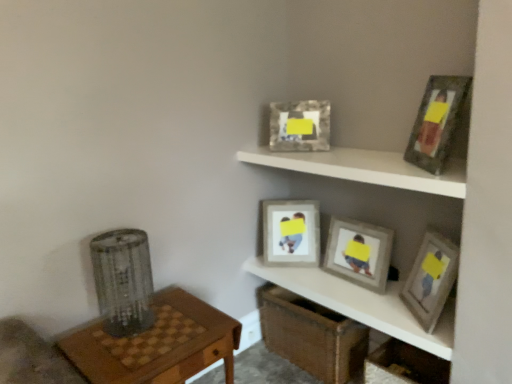
Where is `wooden picture frames at center, positioned as the 1th shelf in bottom-to-top order`? The width and height of the screenshot is (512, 384). wooden picture frames at center, positioned as the 1th shelf in bottom-to-top order is located at coordinates (362, 304).

Identify the location of woven brown crate at lower center. The width and height of the screenshot is (512, 384). (311, 335).

The image size is (512, 384). What do you see at coordinates (158, 344) in the screenshot?
I see `wooden at left` at bounding box center [158, 344].

Locate an element on the screen. The width and height of the screenshot is (512, 384). wooden picture frames at center, acting as the 2th shelf starting from the top is located at coordinates (362, 304).

Does point (446, 271) come behind point (292, 112)?

No, it is not.

Would you say matte gray picture frame at upper right, which appears as the fourth picture frame when viewed from the back, is a long distance from metallic silver picture frame at upper center, the fourth picture frame in the front-to-back sequence?

matte gray picture frame at upper right, which appears as the fourth picture frame when viewed from the back, is near metallic silver picture frame at upper center, the fourth picture frame in the front-to-back sequence, not far away.

Measure the distance between matte gray picture frame at upper right, which is the 2th picture frame in front-to-back order, and metallic silver picture frame at upper center, the fourth picture frame in the front-to-back sequence.

They are 30.30 inches apart.

Which is more to the left, matte gray picture frame at upper right, which appears as the fourth picture frame when viewed from the back, or metallic silver picture frame at upper center, the fourth picture frame in the front-to-back sequence?

metallic silver picture frame at upper center, the fourth picture frame in the front-to-back sequence.

Considering the positions of objects wooden picture frames at center, acting as the 2th shelf starting from the top, and woven brown crate at lower center in the image provided, who is more to the left, wooden picture frames at center, acting as the 2th shelf starting from the top, or woven brown crate at lower center?

From the viewer's perspective, woven brown crate at lower center appears more on the left side.

From a real-world perspective, is wooden picture frames at center, positioned as the 1th shelf in bottom-to-top order, positioned above or below woven brown crate at lower center?

From a real-world perspective, wooden picture frames at center, positioned as the 1th shelf in bottom-to-top order, is physically above woven brown crate at lower center.

Who is more distant, wooden picture frames at center, acting as the 2th shelf starting from the top, or woven brown crate at lower center?

woven brown crate at lower center is more distant.

Is point (362, 308) farther from viewer compared to point (294, 311)?

No, it is not.

Does white matte shelf at upper center, placed as the 1th shelf when sorted from top to bottom, contain wooden at left?

Definitely not — wooden at left is not inside white matte shelf at upper center, placed as the 1th shelf when sorted from top to bottom.

Which is farther from the camera, (316, 173) or (184, 320)?

Point (316, 173)

Which shelf is the 1st one when counting from the right side of the wooden at left? Please provide its 2D coordinates.

[(364, 168)]

From the image's perspective, which one is positioned lower, white matte shelf at upper center, placed as the 1th shelf when sorted from top to bottom, or wooden at left?

wooden at left.

Is wooden at left spatially inside matte gray picture frame at center, which appears as the 5th picture frame when viewed from the front, or outside of it?

wooden at left exists outside the volume of matte gray picture frame at center, which appears as the 5th picture frame when viewed from the front.

Considering the sizes of objects wooden at left and matte gray picture frame at center, which appears as the 5th picture frame when viewed from the front, in the image provided, who is thinner, wooden at left or matte gray picture frame at center, which appears as the 5th picture frame when viewed from the front,?

With smaller width is matte gray picture frame at center, which appears as the 5th picture frame when viewed from the front.

Is wooden at left to the right of matte gray picture frame at center, which appears as the 5th picture frame when viewed from the front, from the viewer's perspective?

In fact, wooden at left is to the left of matte gray picture frame at center, which appears as the 5th picture frame when viewed from the front.

From the image's perspective, does woven brown crate at lower center appear lower than wooden picture frame at upper right, the 5th picture frame in the back-to-front sequence?

Yes, from the image's perspective, woven brown crate at lower center is below wooden picture frame at upper right, the 5th picture frame in the back-to-front sequence.

Is the position of woven brown crate at lower center less distant than that of wooden picture frame at upper right, arranged as the 1th picture frame when viewed from the front?

That is False.

Does point (279, 324) come farther from viewer compared to point (463, 94)?

That is True.

Considering the relative positions of woven brown crate at lower center and wooden picture frame at upper right, arranged as the 1th picture frame when viewed from the front, in the image provided, is woven brown crate at lower center to the left or to the right of wooden picture frame at upper right, arranged as the 1th picture frame when viewed from the front,?

In the image, woven brown crate at lower center appears on the left side of wooden picture frame at upper right, arranged as the 1th picture frame when viewed from the front.

Choose the correct answer: Is matte gray picture frame at upper right, which is the 2th picture frame in front-to-back order, inside woven brown crate at lower center or outside it?

matte gray picture frame at upper right, which is the 2th picture frame in front-to-back order, is spatially situated outside woven brown crate at lower center.

Considering the sizes of objects matte gray picture frame at upper right, which is the 2th picture frame in front-to-back order, and woven brown crate at lower center in the image provided, who is bigger, matte gray picture frame at upper right, which is the 2th picture frame in front-to-back order, or woven brown crate at lower center?

Bigger between the two is woven brown crate at lower center.

Considering the points (444, 293) and (320, 338), which point is in front, point (444, 293) or point (320, 338)?

Point (444, 293)

Which is in front, matte gray picture frame at upper right, which appears as the fourth picture frame when viewed from the back, or woven brown crate at lower center?

matte gray picture frame at upper right, which appears as the fourth picture frame when viewed from the back.

From the image's perspective, is matte gray picture frame at center, the 3th picture frame when ordered from front to back, positioned above or below wooden at left?

matte gray picture frame at center, the 3th picture frame when ordered from front to back, is above wooden at left.

Considering the points (357, 265) and (181, 376), which point is behind, point (357, 265) or point (181, 376)?

Point (357, 265)

Considering the sizes of matte gray picture frame at center, the 3th picture frame when ordered from front to back, and wooden at left in the image, is matte gray picture frame at center, the 3th picture frame when ordered from front to back, taller or shorter than wooden at left?

In the image, matte gray picture frame at center, the 3th picture frame when ordered from front to back, appears to be shorter than wooden at left.

Does matte gray picture frame at center, which is the 3th picture frame in back-to-front order, have a greater width compared to wooden at left?

In fact, matte gray picture frame at center, which is the 3th picture frame in back-to-front order, might be narrower than wooden at left.

From a real-world perspective, count 2nd picture frames downward from the metallic silver picture frame at upper center, acting as the 2th picture frame starting from the back, and point to it. Please provide its 2D coordinates.

[(431, 279)]

From the image's perspective, starting from the woven brown crate at lower center, which shelf is the 1st one above? Please provide its 2D coordinates.

[(362, 304)]

Estimate the real-world distances between objects in this image. Which object is further from matte gray picture frame at upper right, which is the 2th picture frame in front-to-back order, matte gray picture frame at center, the 3th picture frame when ordered from front to back, or matte gray picture frame at center, which ranks as the 1th picture frame in back-to-front order?

matte gray picture frame at center, which ranks as the 1th picture frame in back-to-front order, is further to matte gray picture frame at upper right, which is the 2th picture frame in front-to-back order.

Based on their spatial positions, is matte gray picture frame at upper right, which is the 2th picture frame in front-to-back order, or woven brown crate at lower center further from wooden at left?

matte gray picture frame at upper right, which is the 2th picture frame in front-to-back order, is further to wooden at left.

Consider the image. Considering their positions, is wooden at left positioned further to wooden picture frames at center, positioned as the 1th shelf in bottom-to-top order, than matte gray picture frame at upper right, which is the 2th picture frame in front-to-back order?

Based on the image, wooden at left appears to be further to wooden picture frames at center, positioned as the 1th shelf in bottom-to-top order.

Looking at the image, which one is located further to matte gray picture frame at center, the 3th picture frame when ordered from front to back, metallic silver picture frame at upper center, the fourth picture frame in the front-to-back sequence, or matte gray picture frame at upper right, which is the 2th picture frame in front-to-back order?

metallic silver picture frame at upper center, the fourth picture frame in the front-to-back sequence, lies further to matte gray picture frame at center, the 3th picture frame when ordered from front to back, than the other object.

When comparing their distances from woven brown crate at lower center, does metallic silver picture frame at upper center, acting as the 2th picture frame starting from the back, or wooden picture frame at upper right, arranged as the 1th picture frame when viewed from the front, seem closer?

Based on the image, metallic silver picture frame at upper center, acting as the 2th picture frame starting from the back, appears to be nearer to woven brown crate at lower center.

From the image, which object appears to be farther from wooden picture frames at center, acting as the 2th shelf starting from the top, wooden at left or metallic silver picture frame at upper center, the fourth picture frame in the front-to-back sequence?

Based on the image, metallic silver picture frame at upper center, the fourth picture frame in the front-to-back sequence, appears to be further to wooden picture frames at center, acting as the 2th shelf starting from the top.

Based on their spatial positions, is matte gray picture frame at center, which appears as the 5th picture frame when viewed from the front, or wooden picture frames at center, positioned as the 1th shelf in bottom-to-top order, further from metallic silver picture frame at upper center, acting as the 2th picture frame starting from the back?

wooden picture frames at center, positioned as the 1th shelf in bottom-to-top order, is positioned further to the anchor metallic silver picture frame at upper center, acting as the 2th picture frame starting from the back.

Based on their spatial positions, is wooden picture frames at center, positioned as the 1th shelf in bottom-to-top order, or metallic silver picture frame at upper center, acting as the 2th picture frame starting from the back, closer to matte gray picture frame at center, which ranks as the 1th picture frame in back-to-front order?

wooden picture frames at center, positioned as the 1th shelf in bottom-to-top order.

Image resolution: width=512 pixels, height=384 pixels. Find the location of `crate between white matte shelf at upper center, which is counted as the 2th shelf, starting from the bottom, and wooden at left, in the vertical direction`. crate between white matte shelf at upper center, which is counted as the 2th shelf, starting from the bottom, and wooden at left, in the vertical direction is located at coordinates (311, 335).

The image size is (512, 384). Find the location of `crate between wooden picture frames at center, acting as the 2th shelf starting from the top, and matte gray picture frame at center, which ranks as the 1th picture frame in back-to-front order, in the front-back direction`. crate between wooden picture frames at center, acting as the 2th shelf starting from the top, and matte gray picture frame at center, which ranks as the 1th picture frame in back-to-front order, in the front-back direction is located at coordinates (311, 335).

Identify the location of crate between wooden at left and matte gray picture frame at upper right, which appears as the fourth picture frame when viewed from the back. (311, 335).

I want to click on shelf between wooden picture frame at upper right, the 5th picture frame in the back-to-front sequence, and matte gray picture frame at center, which ranks as the 1th picture frame in back-to-front order, in the front-back direction, so click(x=362, y=304).